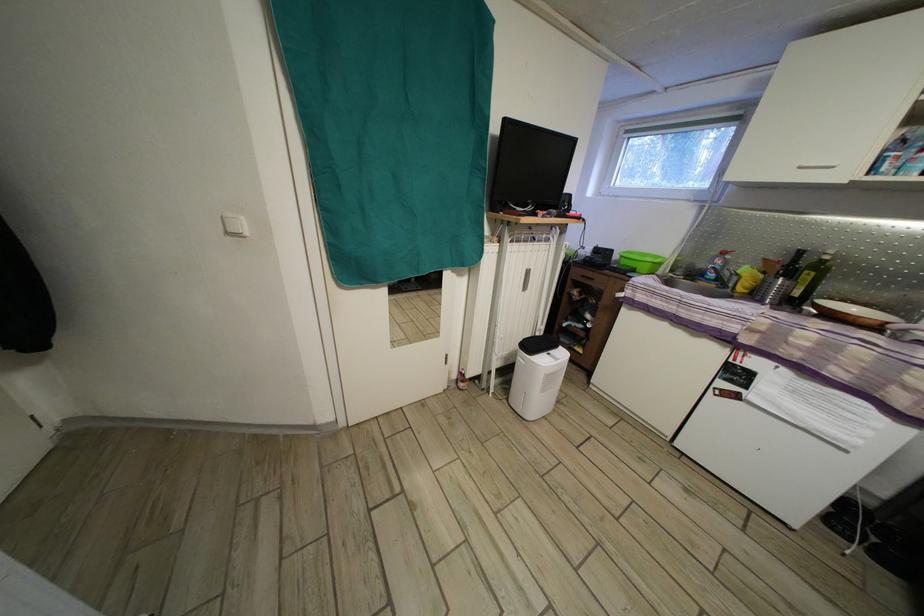
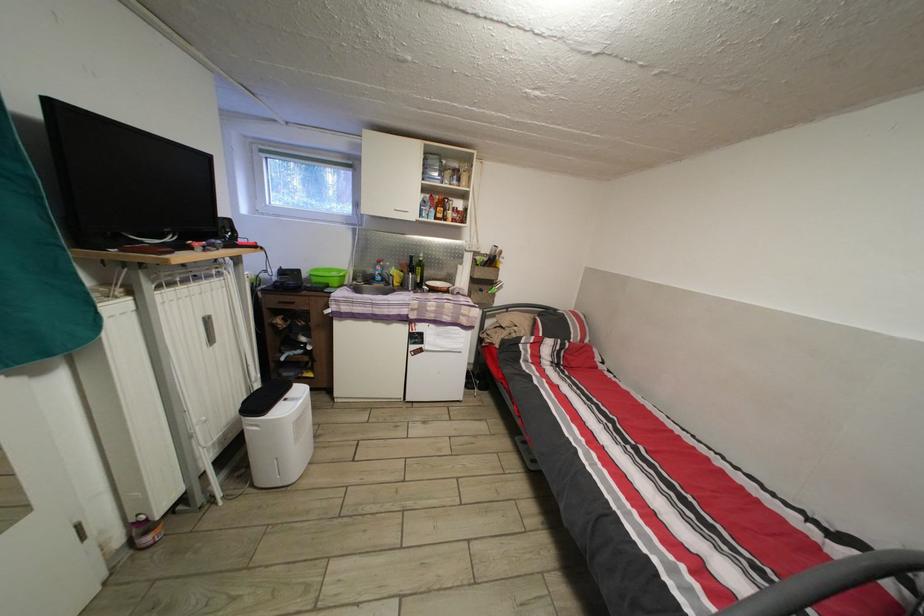
In the second image, find the point that corresponds to (464,387) in the first image.

(138, 548)